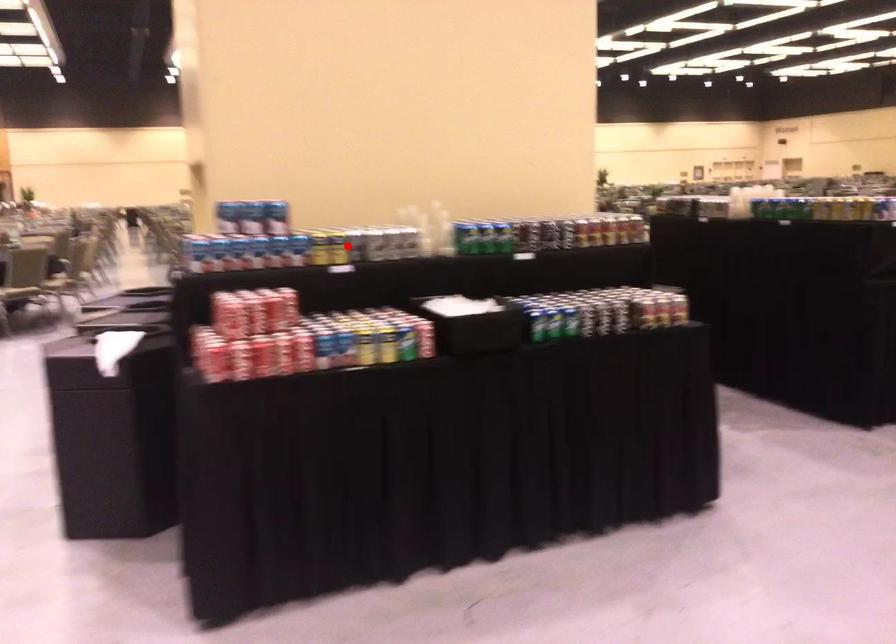
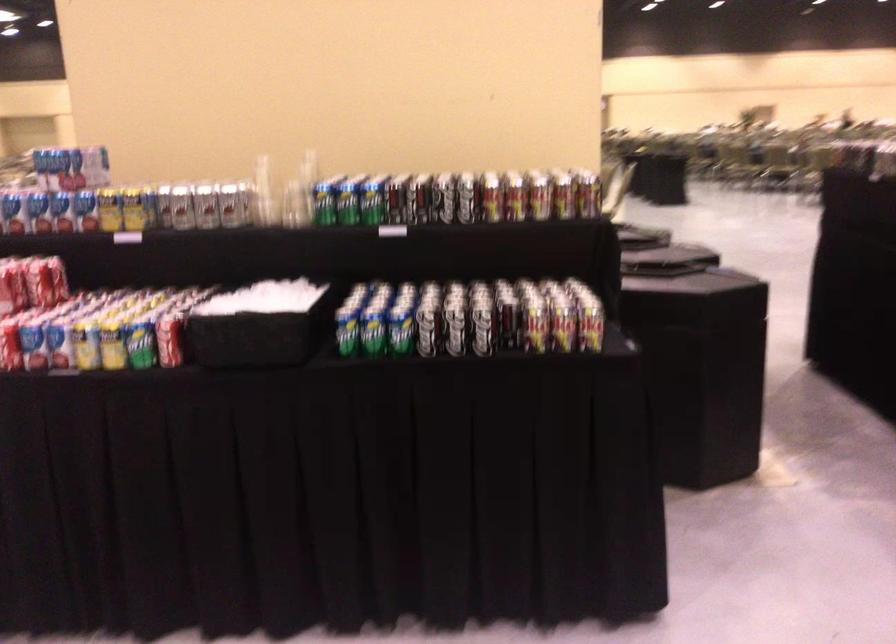
The point at the highlighted location is marked in the first image. Where is the corresponding point in the second image?

(162, 205)